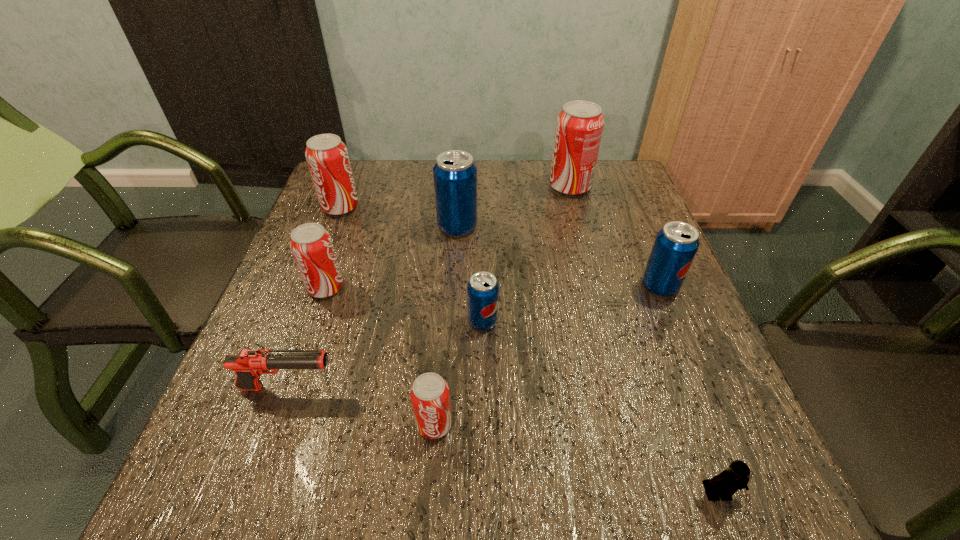
You are a GUI agent. You are given a task and a screenshot of the screen. Output one action in this format:
    pyautogui.click(x=<x>, y=<y>)
    Task: Click on the blank area located on the logo side of the second smallest red soda can
    This screenshot has height=540, width=960.
    Given the screenshot: What is the action you would take?
    pyautogui.click(x=506, y=288)

Where is `vacant region located 0.150m on the front of the rightmost soda can`? The image size is (960, 540). vacant region located 0.150m on the front of the rightmost soda can is located at coordinates (689, 356).

At what (x,y) coordinates should I click in order to perform the action: click on free spot located 0.200m on the back of the sixth farthest soda can. Please return your answer as a coordinate pair (x, y). Looking at the image, I should click on (483, 248).

The image size is (960, 540). What are the coordinates of `vacant region located 0.060m on the logo side of the nearest red soda can` in the screenshot? It's located at (430, 478).

Where is `vacant space located 0.190m at the aiming end of the black gun`? vacant space located 0.190m at the aiming end of the black gun is located at coordinates (442, 388).

Where is `object present at the near edge`? The width and height of the screenshot is (960, 540). object present at the near edge is located at coordinates (726, 484).

Where is `gun situated at the left edge`? This screenshot has width=960, height=540. gun situated at the left edge is located at coordinates (248, 364).

Locate an element on the screen. Image resolution: width=960 pixels, height=540 pixels. Lego positioned at the right edge is located at coordinates (726, 484).

The width and height of the screenshot is (960, 540). I want to click on object at the far left corner, so click(x=327, y=157).

Find the location of a particular element. object situated at the far right corner is located at coordinates (579, 126).